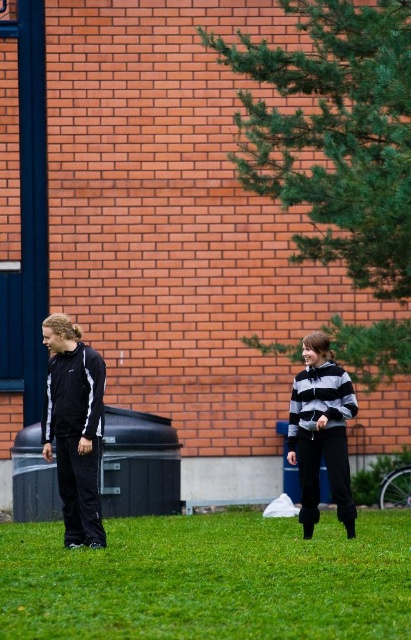
Question: Does green grass at lower center appear on the left side of matte black tracksuit at left?

Choices:
 (A) yes
 (B) no

Answer: (B)

Question: Where is green grass at lower center located in relation to matte black tracksuit at left in the image?

Choices:
 (A) above
 (B) below

Answer: (B)

Question: Which point appears farthest from the camera in this image?

Choices:
 (A) (320, 396)
 (B) (92, 480)
 (C) (279, 529)

Answer: (C)

Question: Among these points, which one is nearest to the camera?

Choices:
 (A) (99, 444)
 (B) (337, 458)

Answer: (A)

Question: Does matte black tracksuit at left appear over striped hoodie at center?

Choices:
 (A) yes
 (B) no

Answer: (A)

Question: Which point is farther to the camera?

Choices:
 (A) tap(311, 458)
 (B) tap(353, 570)
 (C) tap(69, 465)

Answer: (A)